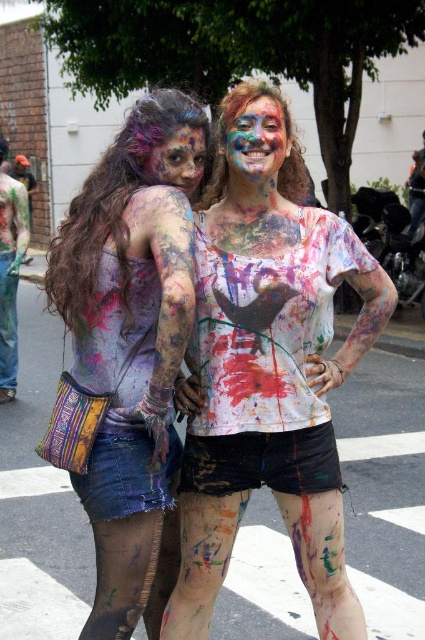
Question: Does paint-covered skin at center have a smaller size compared to painted fabric skirt at center?

Choices:
 (A) yes
 (B) no

Answer: (B)

Question: Is painted fabric skirt at center smaller than multicolored paint face at center?

Choices:
 (A) no
 (B) yes

Answer: (A)

Question: Is painted fabric skirt at center smaller than painted skin face at center?

Choices:
 (A) yes
 (B) no

Answer: (B)

Question: Among these objects, which one is nearest to the camera?

Choices:
 (A) multicolored paint face at center
 (B) painted fabric skirt at center
 (C) paint-covered skin at center
 (D) painted skin face at center

Answer: (B)

Question: Estimate the real-world distances between objects in this image. Which object is closer to the paint-covered skin at center?

Choices:
 (A) multicolored paint face at center
 (B) painted skin face at center

Answer: (B)

Question: Which object is farther from the camera taking this photo?

Choices:
 (A) painted skin face at center
 (B) painted fabric skirt at center

Answer: (A)